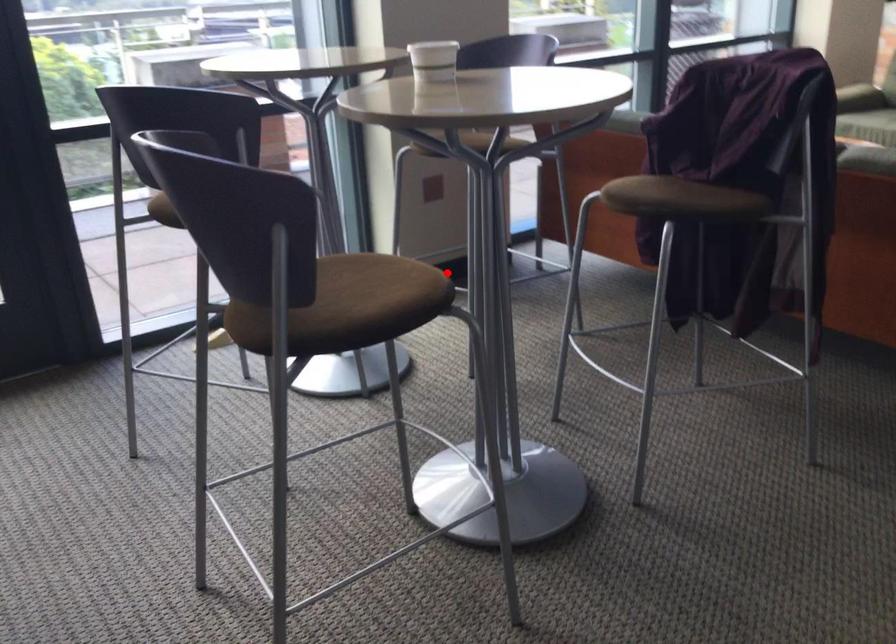
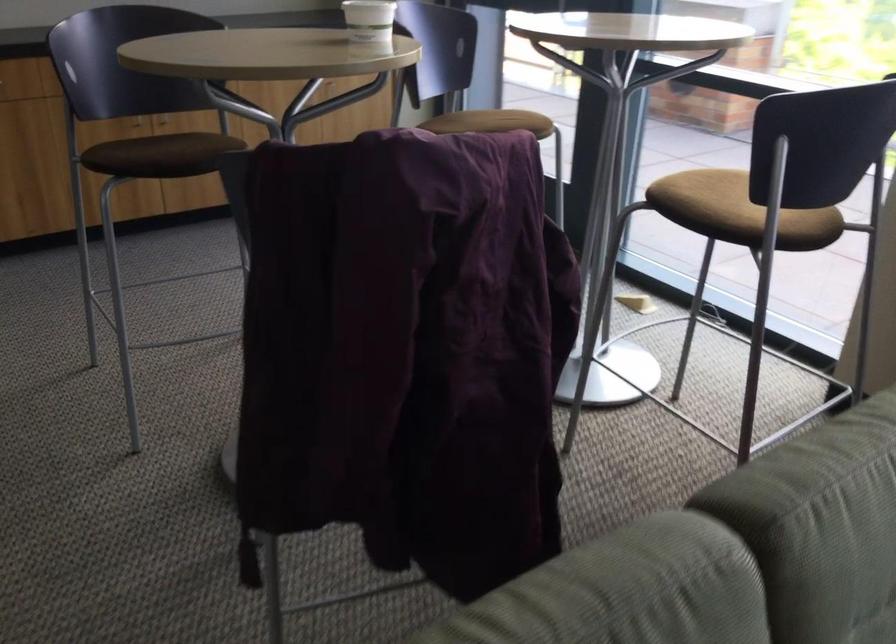
Question: A red point is marked in image1. In image2, is the corresponding 3D point closer to the camera or farther? Reply with the corresponding letter.

Choices:
 (A) The corresponding 3D point is closer.
 (B) The corresponding 3D point is farther.

Answer: (B)